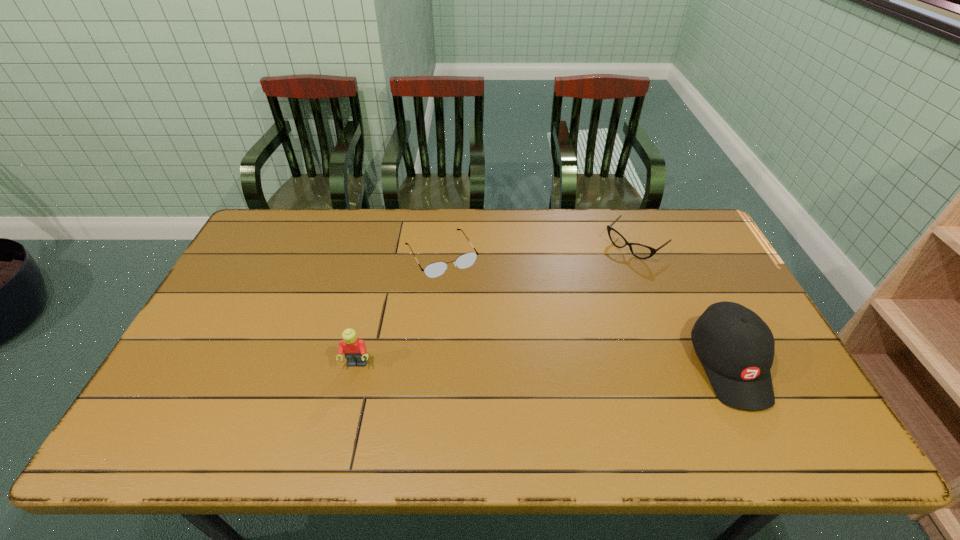
I want to click on free space on the desktop that is between the Lego and the baseball cap and is positioned on the lenses of the second object from left to right, so click(505, 364).

Image resolution: width=960 pixels, height=540 pixels. In order to click on free spot on the desktop that is between the Lego and the baseball cap and is positioned on the front-facing side of the right spectacles in this screenshot , I will do `click(494, 364)`.